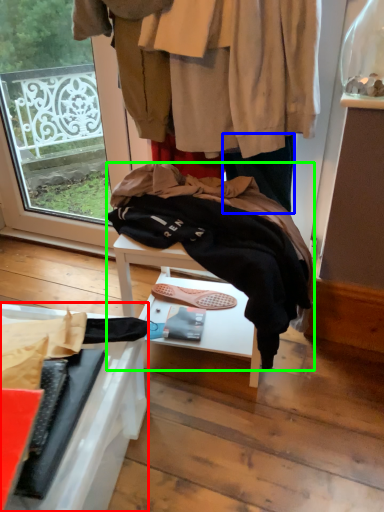
Question: Considering the real-world distances, which object is closest to furniture (highlighted by a red box)? trousers (highlighted by a blue box) or wool (highlighted by a green box).

Choices:
 (A) trousers
 (B) wool

Answer: (B)